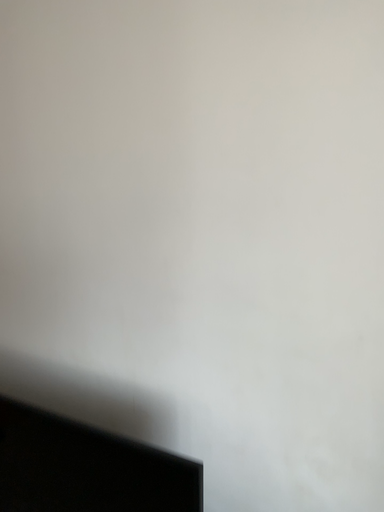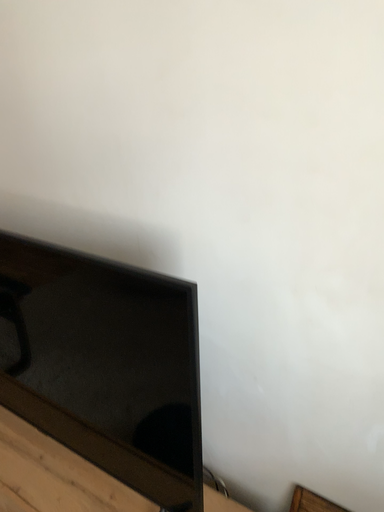
Question: How did the camera likely rotate when shooting the video?

Choices:
 (A) rotated downward
 (B) rotated upward

Answer: (A)